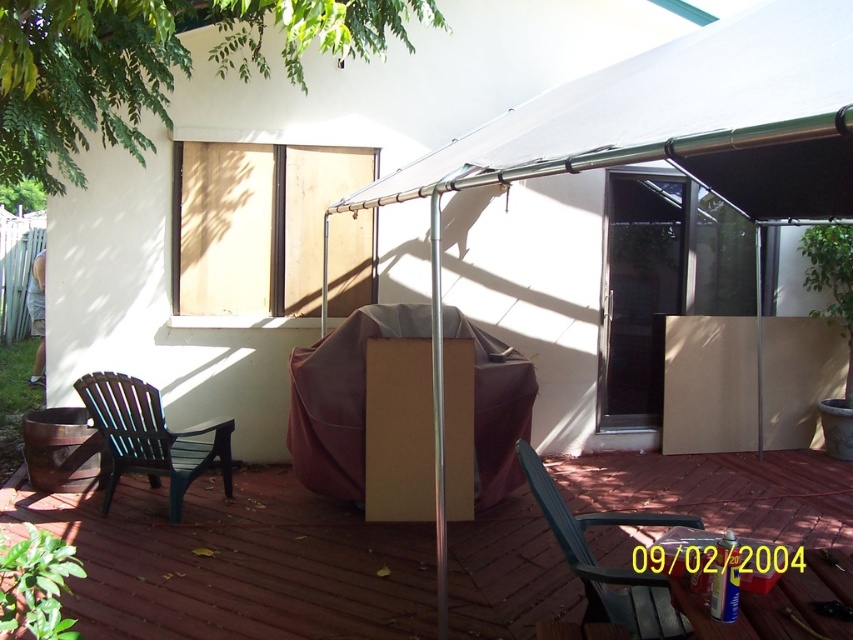
You are standing on the patio and want to place a new potted plant between the brown cardboard box at center and the transparent glass screen door at center. Based on their positions, which object should the plant be closer to?

The brown cardboard box at center is to the left of the transparent glass screen door at center, so the plant should be placed closer to the transparent glass screen door at center to be between them.

You are standing on the patio and want to enter the house through the transparent glass screen door at center. The black plastic armchair at left is blocking your path. Can you move around the chair to reach the door?

The transparent glass screen door at center is to the right of the black plastic armchair at left, so you can move around the chair to the right side to reach the door.

You are standing at the center of the patio and want to place a small potted plant between the two points labeled point (630, 376) and point (149, 467). Which point should the plant be closer to so it stays in front of the other point?

The plant should be placed closer to point (149, 467) because point (630, 376) is behind point (149, 467), so placing it near the front point keeps it visible.